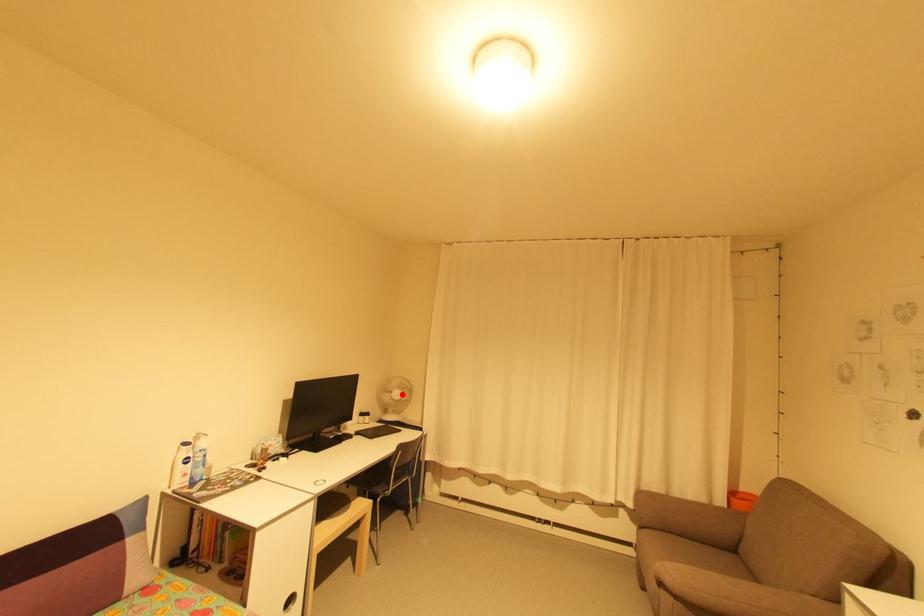
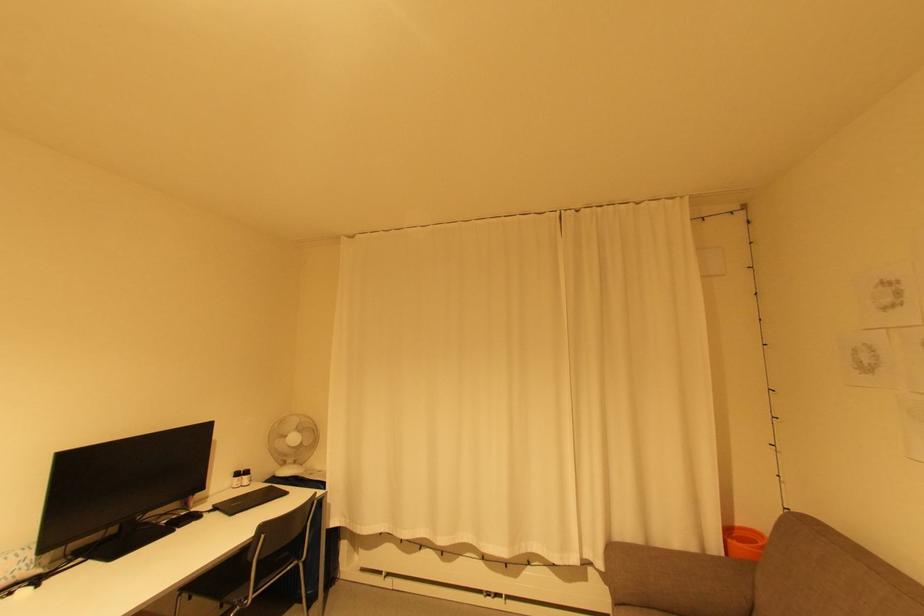
In the second image, find the point that corresponds to the highlighted location in the first image.

(298, 439)